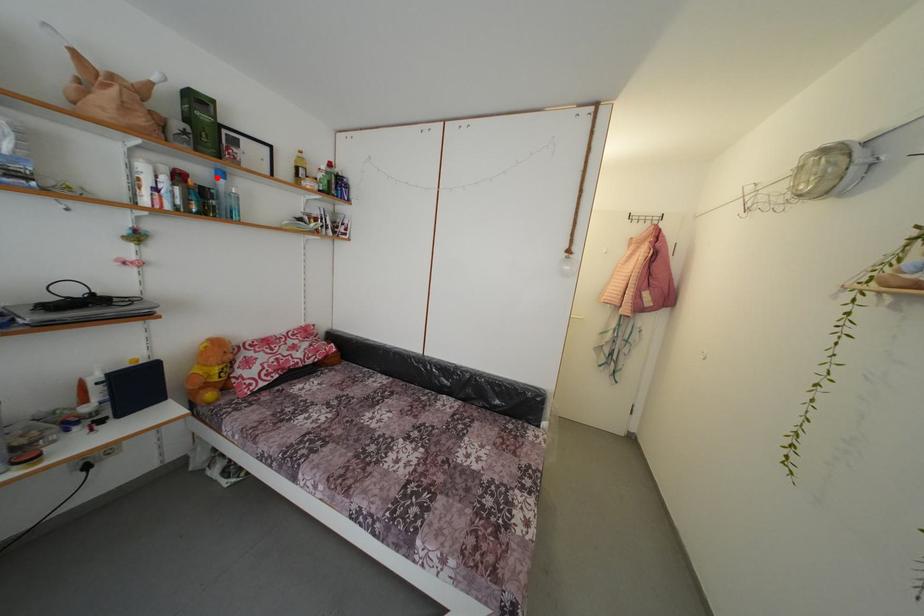
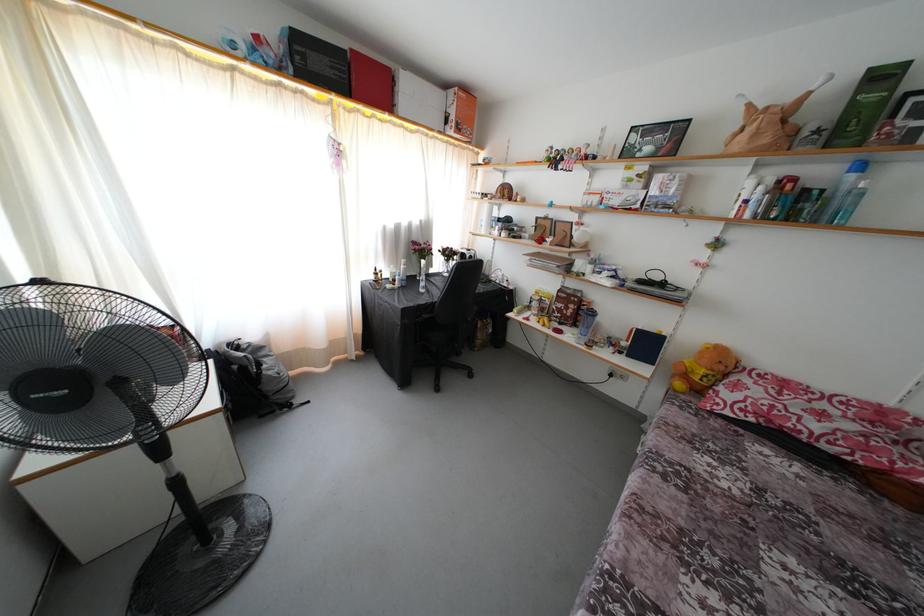
Question: I am providing you with two images of the same scene from different viewpoints. In image1, a red point is highlighted. Considering the same 3D point in image2, which of the following is correct?

Choices:
 (A) It is closer
 (B) It is farther

Answer: (B)